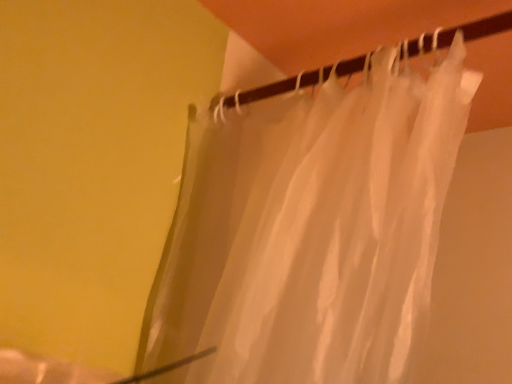
Identify the location of translucent white curtain at upper center. (310, 232).

Measure the distance between translucent white curtain at upper center and camera.

50.16 centimeters.

Image resolution: width=512 pixels, height=384 pixels. What do you see at coordinates (310, 232) in the screenshot? I see `translucent white curtain at upper center` at bounding box center [310, 232].

Locate an element on the screen. The height and width of the screenshot is (384, 512). translucent fabric at upper center is located at coordinates [463, 34].

In the scene shown: In order to face translucent fabric at upper center, should I rotate leftwards or rightwards?

Rotate right and turn 10.094 degrees.

Based on the photo, measure the distance between translucent fabric at upper center and camera.

They are 22.62 inches apart.

The width and height of the screenshot is (512, 384). Describe the element at coordinates (463, 34) in the screenshot. I see `translucent fabric at upper center` at that location.

Where is `translucent white curtain at upper center`? The image size is (512, 384). translucent white curtain at upper center is located at coordinates (310, 232).

Considering the positions of objects translucent fabric at upper center and translucent white curtain at upper center in the image provided, who is more to the left, translucent fabric at upper center or translucent white curtain at upper center?

From the viewer's perspective, translucent fabric at upper center appears more on the left side.

Looking at this image, is the position of translucent fabric at upper center less distant than that of translucent white curtain at upper center?

No, the depth of translucent fabric at upper center is greater than that of translucent white curtain at upper center.

Considering the points (359, 71) and (381, 226), which point is in front, point (359, 71) or point (381, 226)?

The point (381, 226) is closer to the camera.

From the image's perspective, would you say translucent fabric at upper center is positioned over translucent white curtain at upper center?

Indeed, from the image's perspective, translucent fabric at upper center is shown above translucent white curtain at upper center.

From a real-world perspective, is translucent fabric at upper center positioned above or below translucent white curtain at upper center?

In terms of real-world spatial position, translucent fabric at upper center is above translucent white curtain at upper center.

Which object is thinner, translucent fabric at upper center or translucent white curtain at upper center?

translucent fabric at upper center.

Can you confirm if translucent fabric at upper center is shorter than translucent white curtain at upper center?

Yes.

Can you confirm if translucent fabric at upper center is smaller than translucent white curtain at upper center?

Indeed, translucent fabric at upper center has a smaller size compared to translucent white curtain at upper center.

Would you say translucent fabric at upper center is outside translucent white curtain at upper center?

No, translucent fabric at upper center is inside or overlapping with translucent white curtain at upper center.

Is translucent fabric at upper center not near translucent white curtain at upper center?

No, there isn't a large distance between translucent fabric at upper center and translucent white curtain at upper center.

Could you tell me if translucent fabric at upper center is turned towards translucent white curtain at upper center?

Yes, translucent fabric at upper center is aimed at translucent white curtain at upper center.

Find the location of a particular element. curtain in front of the translucent fabric at upper center is located at coordinates (310, 232).

Which object is positioned more to the left, translucent white curtain at upper center or translucent fabric at upper center?

translucent fabric at upper center is more to the left.

Relative to translucent fabric at upper center, is translucent white curtain at upper center in front or behind?

translucent white curtain at upper center is in front of translucent fabric at upper center.

Between point (290, 292) and point (290, 90), which one is positioned behind?

The point (290, 90) is farther from the camera.

From the image's perspective, who appears lower, translucent white curtain at upper center or translucent fabric at upper center?

translucent white curtain at upper center is shown below in the image.

From a real-world perspective, which is physically below, translucent white curtain at upper center or translucent fabric at upper center?

translucent white curtain at upper center is physically lower.

Which object is wider, translucent white curtain at upper center or translucent fabric at upper center?

translucent white curtain at upper center.

Who is taller, translucent white curtain at upper center or translucent fabric at upper center?

translucent white curtain at upper center.

Can you confirm if translucent white curtain at upper center is smaller than translucent fabric at upper center?

Actually, translucent white curtain at upper center might be larger than translucent fabric at upper center.

Can translucent fabric at upper center be found inside translucent white curtain at upper center?

Yes, translucent fabric at upper center is a part of translucent white curtain at upper center.

Is translucent white curtain at upper center directly adjacent to translucent fabric at upper center?

No, translucent white curtain at upper center is not in contact with translucent fabric at upper center.

Is translucent white curtain at upper center facing towards translucent fabric at upper center?

No.

What's the angular difference between translucent white curtain at upper center and translucent fabric at upper center's facing directions?

The angular difference between translucent white curtain at upper center and translucent fabric at upper center is 1.39 degrees.

Locate an element on the screen. The width and height of the screenshot is (512, 384). curtain lying in front of the translucent fabric at upper center is located at coordinates (310, 232).

You are a GUI agent. You are given a task and a screenshot of the screen. Output one action in this format:
    pyautogui.click(x=<x>, y=<y>)
    Task: Click on the clothesline that is above the translucent white curtain at upper center (from a real-world perspective)
    
    Given the screenshot: What is the action you would take?
    pyautogui.click(x=463, y=34)

Find the location of a particular element. The image size is (512, 384). curtain that appears below the translucent fabric at upper center (from a real-world perspective) is located at coordinates (310, 232).